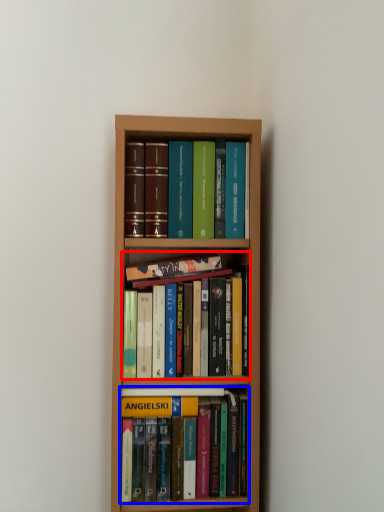
Question: Which point is closer to the camera, book (highlighted by a red box) or book (highlighted by a blue box)?

Choices:
 (A) book
 (B) book

Answer: (A)